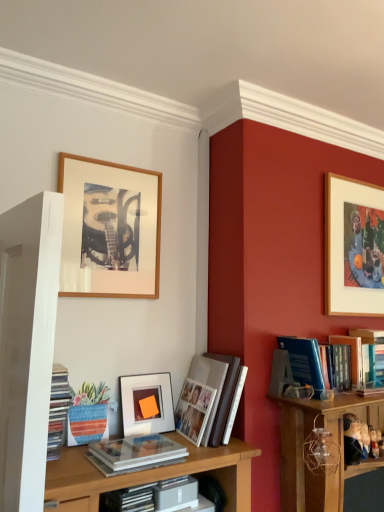
Question: Is the depth of blue hardcover book at center-right, which is the 2th book in right-to-left order, less than that of matte white book at center, the 2th book when ordered from left to right?

Choices:
 (A) yes
 (B) no

Answer: (B)

Question: Is blue hardcover book at center-right, which is the 2th book in right-to-left order, at the left side of matte white book at center, which ranks as the 4th book in right-to-left order?

Choices:
 (A) yes
 (B) no

Answer: (B)

Question: Is blue hardcover book at center-right, which ranks as the fourth book in left-to-right order, at the right side of matte white book at center, the 2th book when ordered from left to right?

Choices:
 (A) yes
 (B) no

Answer: (A)

Question: Is blue hardcover book at center-right, which is the 2th book in right-to-left order, not within matte white book at center, which ranks as the 4th book in right-to-left order?

Choices:
 (A) no
 (B) yes

Answer: (B)

Question: From the image's perspective, is blue hardcover book at center-right, which ranks as the fourth book in left-to-right order, above matte white book at center, which ranks as the 4th book in right-to-left order?

Choices:
 (A) yes
 (B) no

Answer: (A)

Question: Is point (56, 437) closer or farther from the camera than point (370, 380)?

Choices:
 (A) closer
 (B) farther

Answer: (A)

Question: From the image's perspective, is matte plastic books at left, which ranks as the fifth book in right-to-left order, located above or below blue hardcover book at upper right, marked as the fifth book in a left-to-right arrangement?

Choices:
 (A) above
 (B) below

Answer: (B)

Question: From a real-world perspective, is matte plastic books at left, marked as the first book in a left-to-right arrangement, positioned above or below blue hardcover book at upper right, marked as the fifth book in a left-to-right arrangement?

Choices:
 (A) above
 (B) below

Answer: (B)

Question: In the image, is matte plastic books at left, which ranks as the fifth book in right-to-left order, on the left side or the right side of blue hardcover book at upper right, positioned as the first book in right-to-left order?

Choices:
 (A) left
 (B) right

Answer: (A)

Question: In terms of height, does wooden framed artwork at upper right, which is counted as the 1th picture frame, starting from the right, look taller or shorter compared to gray matte book at center?

Choices:
 (A) short
 (B) tall

Answer: (B)

Question: Which is correct: wooden framed artwork at upper right, which ranks as the 3th picture frame in left-to-right order, is inside gray matte book at center, or outside of it?

Choices:
 (A) inside
 (B) outside

Answer: (B)

Question: Considering the positions of wooden framed artwork at upper right, which ranks as the 3th picture frame in left-to-right order, and gray matte book at center in the image, is wooden framed artwork at upper right, which ranks as the 3th picture frame in left-to-right order, bigger or smaller than gray matte book at center?

Choices:
 (A) small
 (B) big

Answer: (B)

Question: Visually, is wooden framed artwork at upper right, which ranks as the 3th picture frame in left-to-right order, positioned to the left or to the right of gray matte book at center?

Choices:
 (A) right
 (B) left

Answer: (A)

Question: From the image's perspective, relative to white paper photo album at center, which is the third book from right to left, is matte white book at center, which ranks as the 4th book in right-to-left order, above or below?

Choices:
 (A) below
 (B) above

Answer: (A)

Question: Looking at their shapes, would you say matte white book at center, the 2th book when ordered from left to right, is wider or thinner than white paper photo album at center, acting as the 3th book starting from the left?

Choices:
 (A) thin
 (B) wide

Answer: (A)